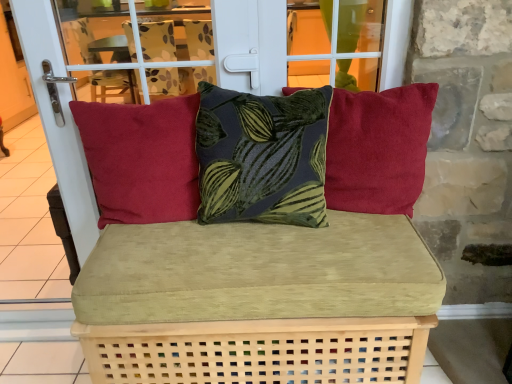
What is the approximate height of velvet green leaf-patterned pillow at center, the second pillow in the right-to-left sequence?

velvet green leaf-patterned pillow at center, the second pillow in the right-to-left sequence, is 17.72 inches in height.

You are a GUI agent. You are given a task and a screenshot of the screen. Output one action in this format:
    pyautogui.click(x=<x>, y=<y>)
    Task: Click on the velvet green cushion at center
    
    Given the screenshot: What is the action you would take?
    pyautogui.click(x=258, y=302)

Is velvet green leaf-patterned pillow at center, the 2th pillow in the left-to-right sequence, oriented away from velvet green cushion at center?

That's not correct — velvet green leaf-patterned pillow at center, the 2th pillow in the left-to-right sequence, is not looking away from velvet green cushion at center.

Is velvet green leaf-patterned pillow at center, the second pillow in the right-to-left sequence, in front of or behind velvet green cushion at center in the image?

Visually, velvet green leaf-patterned pillow at center, the second pillow in the right-to-left sequence, is located behind velvet green cushion at center.

Which is closer, (216, 208) or (327, 91)?

Point (216, 208) is farther from the camera than point (327, 91).

Considering the relative sizes of velvet green leaf-patterned pillow at center, the second pillow in the right-to-left sequence, and velvet green cushion at center in the image provided, is velvet green leaf-patterned pillow at center, the second pillow in the right-to-left sequence, thinner than velvet green cushion at center?

Correct, the width of velvet green leaf-patterned pillow at center, the second pillow in the right-to-left sequence, is less than that of velvet green cushion at center.

Is point (395, 205) more distant than point (186, 169)?

Yes, it is.

Is matte red cushion at right, the third pillow when ordered from left to right, positioned far away from matte red cushion at left, positioned as the 1th pillow in left-to-right order?

No, matte red cushion at right, the third pillow when ordered from left to right, is in close proximity to matte red cushion at left, positioned as the 1th pillow in left-to-right order.

In order to click on pillow located underneath the matte red cushion at right, the third pillow when ordered from left to right (from a real-world perspective) in this screenshot , I will do `click(141, 159)`.

Is matte red cushion at right, the first pillow in the right-to-left sequence, far from velvet green leaf-patterned pillow at center, the second pillow in the right-to-left sequence?

No, matte red cushion at right, the first pillow in the right-to-left sequence, is in close proximity to velvet green leaf-patterned pillow at center, the second pillow in the right-to-left sequence.

Between matte red cushion at right, the first pillow in the right-to-left sequence, and velvet green leaf-patterned pillow at center, the 2th pillow in the left-to-right sequence, which one has smaller width?

matte red cushion at right, the first pillow in the right-to-left sequence, is thinner.

How distant is matte red cushion at right, the first pillow in the right-to-left sequence, from velvet green leaf-patterned pillow at center, the second pillow in the right-to-left sequence?

7.81 inches.

Is point (173, 284) positioned behind point (223, 147)?

No, (173, 284) is closer to viewer.

From a real-world perspective, which is physically below, velvet green cushion at center or velvet green leaf-patterned pillow at center, the second pillow in the right-to-left sequence?

velvet green cushion at center, from a real-world perspective.

Considering the sizes of objects velvet green cushion at center and velvet green leaf-patterned pillow at center, the second pillow in the right-to-left sequence, in the image provided, who is smaller, velvet green cushion at center or velvet green leaf-patterned pillow at center, the second pillow in the right-to-left sequence,?

Smaller between the two is velvet green leaf-patterned pillow at center, the second pillow in the right-to-left sequence.

In the image, is velvet green cushion at center on the left side or the right side of velvet green leaf-patterned pillow at center, the second pillow in the right-to-left sequence?

Clearly, velvet green cushion at center is on the left of velvet green leaf-patterned pillow at center, the second pillow in the right-to-left sequence, in the image.

Which object is positioned more to the left, velvet green cushion at center or matte red cushion at left, acting as the third pillow starting from the right?

From the viewer's perspective, matte red cushion at left, acting as the third pillow starting from the right, appears more on the left side.

Consider the image. Is velvet green cushion at center taller than matte red cushion at left, acting as the third pillow starting from the right?

Yes, velvet green cushion at center is taller than matte red cushion at left, acting as the third pillow starting from the right.

In the image, there is a matte red cushion at left, positioned as the 1th pillow in left-to-right order. Where is `studio couch below it (from a real-world perspective)`? The width and height of the screenshot is (512, 384). studio couch below it (from a real-world perspective) is located at coordinates (258, 302).

Between point (227, 375) and point (127, 201), which one is positioned in front?

Point (227, 375)

Would you say matte red cushion at left, positioned as the 1th pillow in left-to-right order, is to the left or to the right of velvet green leaf-patterned pillow at center, the 2th pillow in the left-to-right sequence, in the picture?

Clearly, matte red cushion at left, positioned as the 1th pillow in left-to-right order, is on the left of velvet green leaf-patterned pillow at center, the 2th pillow in the left-to-right sequence, in the image.

From the image's perspective, does matte red cushion at left, positioned as the 1th pillow in left-to-right order, appear lower than velvet green leaf-patterned pillow at center, the second pillow in the right-to-left sequence?

Correct, matte red cushion at left, positioned as the 1th pillow in left-to-right order, appears lower than velvet green leaf-patterned pillow at center, the second pillow in the right-to-left sequence, in the image.

At what (x,y) coordinates should I click in order to perform the action: click on pillow to the left of velvet green leaf-patterned pillow at center, the second pillow in the right-to-left sequence. Please return your answer as a coordinate pair (x, y). The image size is (512, 384). Looking at the image, I should click on (141, 159).

Which is less distant, (126, 146) or (246, 137)?

Point (126, 146).

Locate an element on the screen. The image size is (512, 384). pillow that is the 2nd object located behind the velvet green cushion at center is located at coordinates (378, 148).

In the scene shown: Is velvet green cushion at center oriented away from matte red cushion at right, the first pillow in the right-to-left sequence?

No, velvet green cushion at center is not facing away from matte red cushion at right, the first pillow in the right-to-left sequence.

Who is smaller, velvet green cushion at center or matte red cushion at right, the first pillow in the right-to-left sequence?

With smaller size is matte red cushion at right, the first pillow in the right-to-left sequence.

Consider the image. Does velvet green cushion at center have a greater height compared to matte red cushion at right, the first pillow in the right-to-left sequence?

Yes.

From the image's perspective, count 2nd pillows upward from the velvet green cushion at center and point to it. Please provide its 2D coordinates.

[(262, 156)]

The height and width of the screenshot is (384, 512). I want to click on the 2nd pillow to the left when counting from the matte red cushion at right, the first pillow in the right-to-left sequence, so click(141, 159).

Estimate the real-world distances between objects in this image. Which object is further from velvet green cushion at center, matte red cushion at right, the first pillow in the right-to-left sequence, or matte red cushion at left, acting as the third pillow starting from the right?

matte red cushion at right, the first pillow in the right-to-left sequence, is further to velvet green cushion at center.

From the image, which object appears to be nearer to matte red cushion at right, the first pillow in the right-to-left sequence, velvet green cushion at center or matte red cushion at left, positioned as the 1th pillow in left-to-right order?

velvet green cushion at center.

When comparing their distances from velvet green leaf-patterned pillow at center, the 2th pillow in the left-to-right sequence, does matte red cushion at left, acting as the third pillow starting from the right, or velvet green cushion at center seem closer?

velvet green cushion at center is closer to velvet green leaf-patterned pillow at center, the 2th pillow in the left-to-right sequence.

From the image, which object appears to be farther from matte red cushion at left, acting as the third pillow starting from the right, matte red cushion at right, the third pillow when ordered from left to right, or velvet green leaf-patterned pillow at center, the 2th pillow in the left-to-right sequence?

matte red cushion at right, the third pillow when ordered from left to right.

Based on their spatial positions, is velvet green leaf-patterned pillow at center, the 2th pillow in the left-to-right sequence, or matte red cushion at left, acting as the third pillow starting from the right, further from velvet green cushion at center?

Among the two, matte red cushion at left, acting as the third pillow starting from the right, is located further to velvet green cushion at center.

Considering their positions, is matte red cushion at left, positioned as the 1th pillow in left-to-right order, positioned closer to velvet green cushion at center than matte red cushion at right, the first pillow in the right-to-left sequence?

The object closer to velvet green cushion at center is matte red cushion at left, positioned as the 1th pillow in left-to-right order.

From the image, which object appears to be nearer to matte red cushion at right, the first pillow in the right-to-left sequence, velvet green leaf-patterned pillow at center, the second pillow in the right-to-left sequence, or matte red cushion at left, acting as the third pillow starting from the right?

The object closer to matte red cushion at right, the first pillow in the right-to-left sequence, is velvet green leaf-patterned pillow at center, the second pillow in the right-to-left sequence.

Which object lies further to the anchor point velvet green leaf-patterned pillow at center, the second pillow in the right-to-left sequence, matte red cushion at right, the first pillow in the right-to-left sequence, or matte red cushion at left, positioned as the 1th pillow in left-to-right order?

matte red cushion at right, the first pillow in the right-to-left sequence, lies further to velvet green leaf-patterned pillow at center, the second pillow in the right-to-left sequence, than the other object.

At what (x,y) coordinates should I click in order to perform the action: click on studio couch between matte red cushion at left, positioned as the 1th pillow in left-to-right order, and matte red cushion at right, the third pillow when ordered from left to right, in the horizontal direction. Please return your answer as a coordinate pair (x, y). The image size is (512, 384). Looking at the image, I should click on (258, 302).

Where is `pillow between velvet green leaf-patterned pillow at center, the second pillow in the right-to-left sequence, and velvet green cushion at center from top to bottom`? This screenshot has width=512, height=384. pillow between velvet green leaf-patterned pillow at center, the second pillow in the right-to-left sequence, and velvet green cushion at center from top to bottom is located at coordinates (141, 159).

Find the location of a particular element. pillow between matte red cushion at left, acting as the third pillow starting from the right, and matte red cushion at right, the first pillow in the right-to-left sequence, from left to right is located at coordinates (262, 156).